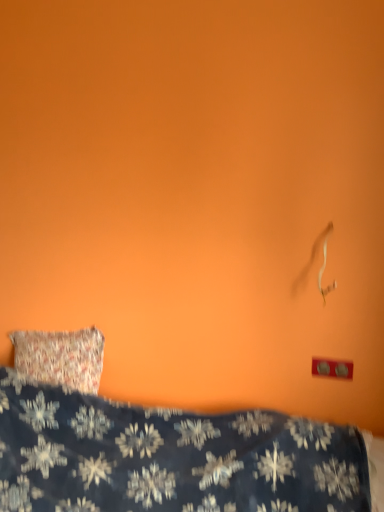
The image size is (384, 512). What do you see at coordinates (160, 447) in the screenshot? I see `dark blue fabric with snowflake pattern at lower left` at bounding box center [160, 447].

Find the location of `dark blue fabric with snowflake pattern at lower left`. dark blue fabric with snowflake pattern at lower left is located at coordinates (160, 447).

Where is `red plastic outlet at lower right`? The height and width of the screenshot is (512, 384). red plastic outlet at lower right is located at coordinates (332, 368).

What do you see at coordinates (332, 368) in the screenshot? Image resolution: width=384 pixels, height=512 pixels. I see `red plastic outlet at lower right` at bounding box center [332, 368].

At what (x,y) coordinates should I click in order to perform the action: click on dark blue fabric with snowflake pattern at lower left. Please return your answer as a coordinate pair (x, y). Looking at the image, I should click on (160, 447).

Considering the relative positions of red plastic outlet at lower right and dark blue fabric with snowflake pattern at lower left in the image provided, is red plastic outlet at lower right to the left or to the right of dark blue fabric with snowflake pattern at lower left?

Clearly, red plastic outlet at lower right is on the right of dark blue fabric with snowflake pattern at lower left in the image.

Between red plastic outlet at lower right and dark blue fabric with snowflake pattern at lower left, which one is positioned behind?

red plastic outlet at lower right is further away from the camera.

Is point (332, 362) positioned behind point (353, 433)?

That is True.

From the image's perspective, is red plastic outlet at lower right above dark blue fabric with snowflake pattern at lower left?

Yes.

From a real-world perspective, is red plastic outlet at lower right under dark blue fabric with snowflake pattern at lower left?

Incorrect, from a real-world perspective, red plastic outlet at lower right is higher than dark blue fabric with snowflake pattern at lower left.

Can you confirm if red plastic outlet at lower right is thinner than dark blue fabric with snowflake pattern at lower left?

Correct, the width of red plastic outlet at lower right is less than that of dark blue fabric with snowflake pattern at lower left.

In terms of height, does red plastic outlet at lower right look taller or shorter compared to dark blue fabric with snowflake pattern at lower left?

In the image, red plastic outlet at lower right appears to be shorter than dark blue fabric with snowflake pattern at lower left.

Does red plastic outlet at lower right have a smaller size compared to dark blue fabric with snowflake pattern at lower left?

Yes, red plastic outlet at lower right is smaller than dark blue fabric with snowflake pattern at lower left.

Could dark blue fabric with snowflake pattern at lower left be considered to be inside red plastic outlet at lower right?

No, dark blue fabric with snowflake pattern at lower left is not inside red plastic outlet at lower right.

Is red plastic outlet at lower right positioned far away from dark blue fabric with snowflake pattern at lower left?

No, red plastic outlet at lower right is in close proximity to dark blue fabric with snowflake pattern at lower left.

Could you tell me if red plastic outlet at lower right is facing dark blue fabric with snowflake pattern at lower left?

No, red plastic outlet at lower right is not turned towards dark blue fabric with snowflake pattern at lower left.

Can you tell me how much red plastic outlet at lower right and dark blue fabric with snowflake pattern at lower left differ in facing direction?

The angular difference between red plastic outlet at lower right and dark blue fabric with snowflake pattern at lower left is 1.43 degrees.

How far apart are red plastic outlet at lower right and dark blue fabric with snowflake pattern at lower left?

red plastic outlet at lower right and dark blue fabric with snowflake pattern at lower left are 29.18 inches apart.

Where is `bed below the red plastic outlet at lower right (from the image's perspective)`? The width and height of the screenshot is (384, 512). bed below the red plastic outlet at lower right (from the image's perspective) is located at coordinates (160, 447).

Can you confirm if dark blue fabric with snowflake pattern at lower left is positioned to the right of red plastic outlet at lower right?

In fact, dark blue fabric with snowflake pattern at lower left is to the left of red plastic outlet at lower right.

Is the depth of dark blue fabric with snowflake pattern at lower left less than that of red plastic outlet at lower right?

Yes.

Does point (1, 489) appear closer or farther from the camera than point (327, 362)?

Point (1, 489).

From the image's perspective, is dark blue fabric with snowflake pattern at lower left beneath red plastic outlet at lower right?

Correct, dark blue fabric with snowflake pattern at lower left appears lower than red plastic outlet at lower right in the image.

From a real-world perspective, between dark blue fabric with snowflake pattern at lower left and red plastic outlet at lower right, who is vertically lower?

From a 3D spatial view, dark blue fabric with snowflake pattern at lower left is below.

Considering the sizes of objects dark blue fabric with snowflake pattern at lower left and red plastic outlet at lower right in the image provided, who is wider, dark blue fabric with snowflake pattern at lower left or red plastic outlet at lower right?

With larger width is dark blue fabric with snowflake pattern at lower left.

Considering the relative sizes of dark blue fabric with snowflake pattern at lower left and red plastic outlet at lower right in the image provided, is dark blue fabric with snowflake pattern at lower left taller than red plastic outlet at lower right?

Indeed, dark blue fabric with snowflake pattern at lower left has a greater height compared to red plastic outlet at lower right.

In terms of size, does dark blue fabric with snowflake pattern at lower left appear bigger or smaller than red plastic outlet at lower right?

In the image, dark blue fabric with snowflake pattern at lower left appears to be larger than red plastic outlet at lower right.

Is red plastic outlet at lower right completely or partially inside dark blue fabric with snowflake pattern at lower left?

Actually, red plastic outlet at lower right is outside dark blue fabric with snowflake pattern at lower left.

Is dark blue fabric with snowflake pattern at lower left not near red plastic outlet at lower right?

dark blue fabric with snowflake pattern at lower left is actually quite close to red plastic outlet at lower right.

Is dark blue fabric with snowflake pattern at lower left oriented away from red plastic outlet at lower right?

dark blue fabric with snowflake pattern at lower left is not turned away from red plastic outlet at lower right.

How many degrees apart are the facing directions of dark blue fabric with snowflake pattern at lower left and red plastic outlet at lower right?

1.43 degrees.

Where is `electric outlet on the right of dark blue fabric with snowflake pattern at lower left`? The width and height of the screenshot is (384, 512). electric outlet on the right of dark blue fabric with snowflake pattern at lower left is located at coordinates (332, 368).

Find the location of a particular element. The height and width of the screenshot is (512, 384). electric outlet above the dark blue fabric with snowflake pattern at lower left (from a real-world perspective) is located at coordinates (332, 368).

Where is `bed below the red plastic outlet at lower right (from a real-world perspective)`? This screenshot has height=512, width=384. bed below the red plastic outlet at lower right (from a real-world perspective) is located at coordinates (160, 447).